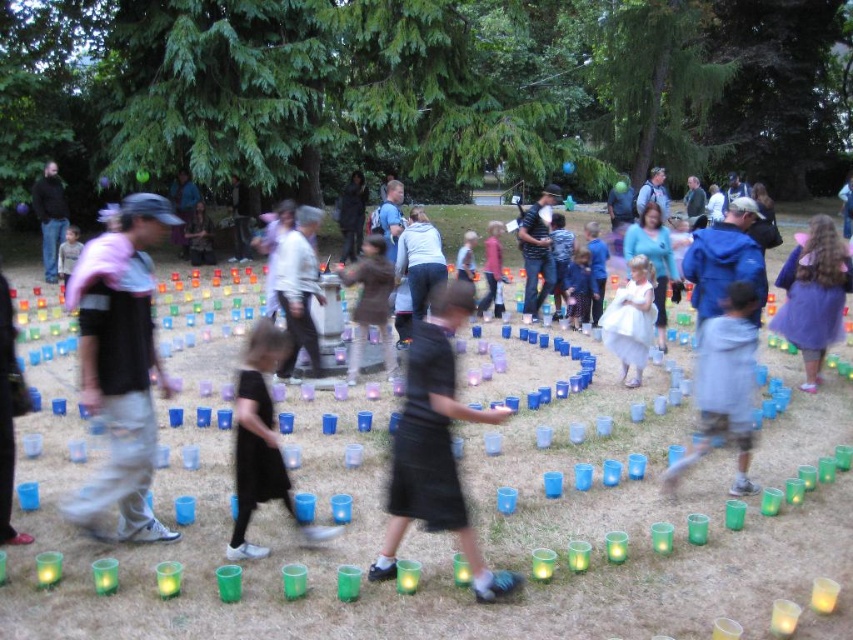
You are standing in the park and see the light gray distressed jeans at left and the black matte skirt at center. Which one is closer to you?

The light gray distressed jeans at left is closer to you because the black matte skirt at center is behind it.

From the picture: You are standing at the center of the circular arrangement of luminaries. Looking towards the left side of the scene, you see a point marked at coordinates (120, 365). What object is located at that point?

The point at coordinates (120, 365) is located on light gray distressed jeans at left.

You are standing in the park and see the light gray distressed jeans at left and the black matte skirt at center. Which item is taller?

The light gray distressed jeans at left is taller than the black matte skirt at center.